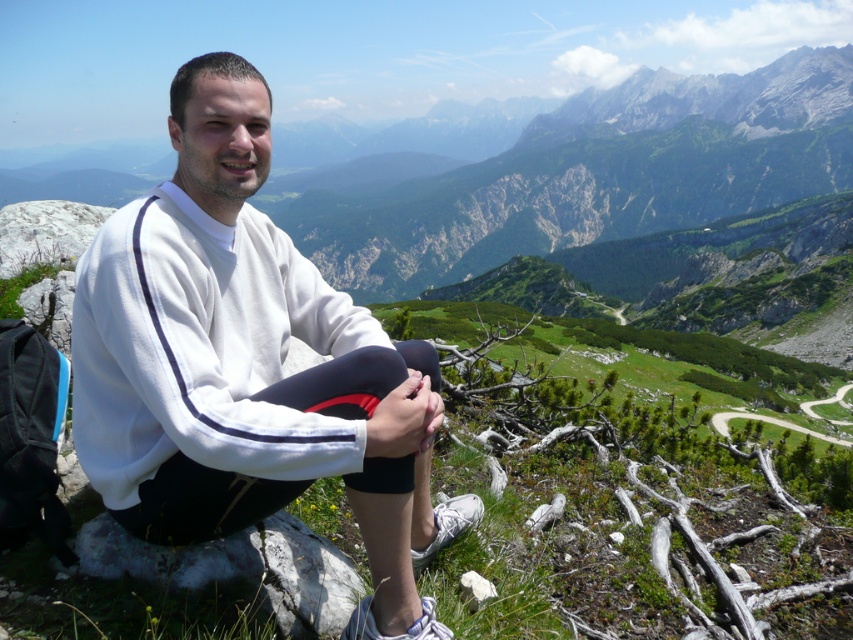
Question: Which point is closer to the camera?

Choices:
 (A) white rough rock at lower center
 (B) white fleece at center

Answer: (B)

Question: Among these objects, which one is nearest to the camera?

Choices:
 (A) white rough rock at lower center
 (B) white fleece at center

Answer: (B)

Question: Does white fleece at center have a larger size compared to white rough rock at lower center?

Choices:
 (A) yes
 (B) no

Answer: (A)

Question: Is the position of white fleece at center less distant than that of white rough rock at lower center?

Choices:
 (A) yes
 (B) no

Answer: (A)

Question: Observing the image, what is the correct spatial positioning of white fleece at center in reference to white rough rock at lower center?

Choices:
 (A) above
 (B) below

Answer: (A)